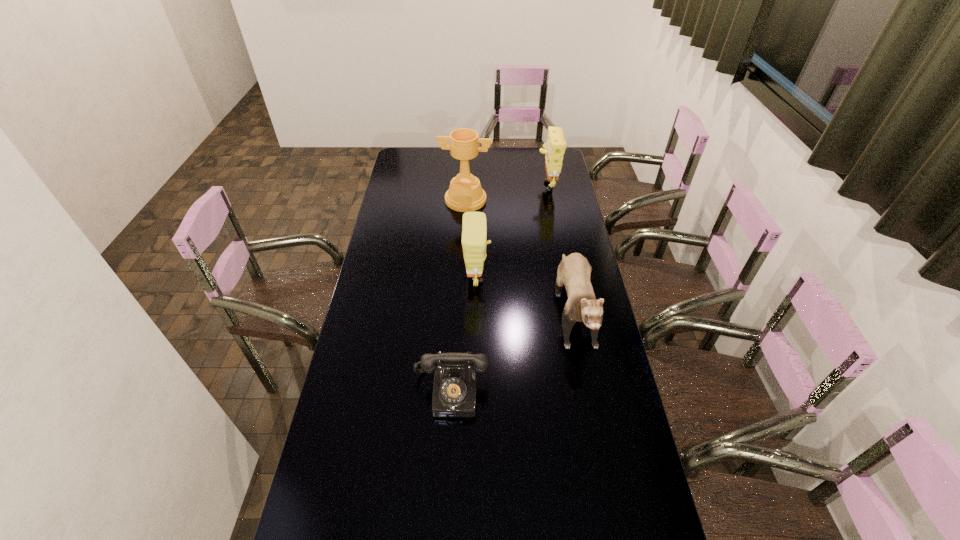
The image size is (960, 540). I want to click on vacant space situated on the face of the ferret, so coord(595,418).

Identify the location of free space located on the dial of the telephone. (446, 478).

At what (x,y) coordinates should I click in order to perform the action: click on sponge located in the right edge section of the desktop. Please return your answer as a coordinate pair (x, y). Looking at the image, I should click on (554, 149).

Where is `ferret located in the right edge section of the desktop`? The width and height of the screenshot is (960, 540). ferret located in the right edge section of the desktop is located at coordinates (574, 271).

Identify the location of vacant area at the far edge of the desktop. (500, 154).

Locate an element on the screen. free space at the left edge of the desktop is located at coordinates (349, 445).

Image resolution: width=960 pixels, height=540 pixels. Find the location of `vacant space at the right edge`. vacant space at the right edge is located at coordinates (551, 219).

Image resolution: width=960 pixels, height=540 pixels. Identify the location of free location at the far left corner. (415, 161).

In the image, there is a desktop. Identify the location of vacant space at the far right corner. Image resolution: width=960 pixels, height=540 pixels. (539, 163).

Identify the location of vacant space that is in between the award and the farther sponge. (506, 192).